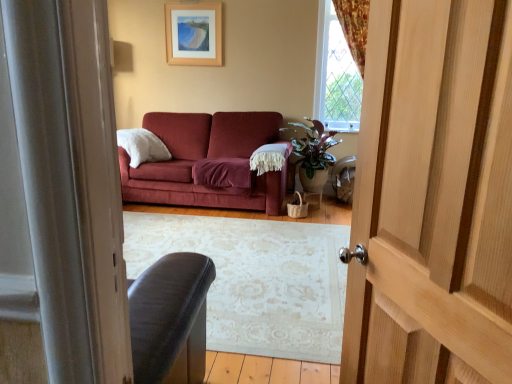
Describe the element at coordinates (313, 154) in the screenshot. I see `green glossy plant at center` at that location.

The width and height of the screenshot is (512, 384). Find the location of `clear glass window at upper right`. clear glass window at upper right is located at coordinates (336, 74).

Find the location of a particular element. wooden picture frame at upper center is located at coordinates (194, 34).

This screenshot has height=384, width=512. Identify the location of light brown wooden door at right. (433, 197).

Who is shorter, wooden picture frame at upper center or light brown wooden door at right?

Standing shorter between the two is wooden picture frame at upper center.

Consider the image. Considering the relative sizes of wooden picture frame at upper center and light brown wooden door at right in the image provided, is wooden picture frame at upper center bigger than light brown wooden door at right?

Actually, wooden picture frame at upper center might be smaller than light brown wooden door at right.

Measure the distance from wooden picture frame at upper center to light brown wooden door at right.

The distance of wooden picture frame at upper center from light brown wooden door at right is 4.11 meters.

Find the location of a particular element. This screenshot has height=384, width=512. door on the right of wooden picture frame at upper center is located at coordinates point(433,197).

In the image, is light brown wooden door at right on the left side or the right side of wooden picture frame at upper center?

light brown wooden door at right is positioned on wooden picture frame at upper center's right side.

Is light brown wooden door at right shorter than wooden picture frame at upper center?

Incorrect, the height of light brown wooden door at right does not fall short of that of wooden picture frame at upper center.

Can you confirm if light brown wooden door at right is wider than wooden picture frame at upper center?

Yes.

How distant is light brown wooden door at right from wooden picture frame at upper center?

light brown wooden door at right and wooden picture frame at upper center are 13.48 feet apart from each other.

Can you confirm if green glossy plant at center is positioned to the left of light brown wooden door at right?

No.

Considering the relative sizes of green glossy plant at center and light brown wooden door at right in the image provided, is green glossy plant at center wider than light brown wooden door at right?

Correct, the width of green glossy plant at center exceeds that of light brown wooden door at right.

Can you confirm if green glossy plant at center is bigger than light brown wooden door at right?

Yes.

Is green glossy plant at center taller or shorter than light brown wooden door at right?

Considering their sizes, green glossy plant at center has less height than light brown wooden door at right.

Can green glossy plant at center be found inside wooden picture frame at upper center?

Actually, green glossy plant at center is outside wooden picture frame at upper center.

Is wooden picture frame at upper center behind green glossy plant at center?

Yes, the depth of wooden picture frame at upper center is greater than that of green glossy plant at center.

Considering the relative sizes of wooden picture frame at upper center and green glossy plant at center in the image provided, is wooden picture frame at upper center taller than green glossy plant at center?

No, wooden picture frame at upper center is not taller than green glossy plant at center.

Can you tell me how much wooden picture frame at upper center and green glossy plant at center differ in facing direction?

There is a 1.53-degree angle between the facing directions of wooden picture frame at upper center and green glossy plant at center.

From a real-world perspective, is green glossy plant at center under clear glass window at upper right?

Correct, in the physical world, green glossy plant at center is lower than clear glass window at upper right.

Is green glossy plant at center positioned beyond the bounds of clear glass window at upper right?

Yes, green glossy plant at center is located beyond the bounds of clear glass window at upper right.

Is clear glass window at upper right at the back of green glossy plant at center?

Yes, green glossy plant at center is facing away from clear glass window at upper right.

Between green glossy plant at center and clear glass window at upper right, which one has less height?

green glossy plant at center is shorter.

Between light brown wooden door at right and green glossy plant at center, which one appears on the left side from the viewer's perspective?

light brown wooden door at right is more to the left.

From the image's perspective, is light brown wooden door at right on green glossy plant at center?

Incorrect, from the image's perspective, light brown wooden door at right is lower than green glossy plant at center.

Are light brown wooden door at right and green glossy plant at center beside each other?

light brown wooden door at right and green glossy plant at center are not in contact.

Does light brown wooden door at right have a smaller size compared to green glossy plant at center?

Indeed, light brown wooden door at right has a smaller size compared to green glossy plant at center.

Is clear glass window at upper right positioned with its back to wooden picture frame at upper center?

No, clear glass window at upper right's orientation is not away from wooden picture frame at upper center.

In the scene shown: Which point is more distant from viewer, (326, 24) or (211, 29)?

The point (211, 29) is behind.

From a real-world perspective, is clear glass window at upper right located higher than wooden picture frame at upper center?

No.

Is clear glass window at upper right surrounding wooden picture frame at upper center?

No, clear glass window at upper right does not contain wooden picture frame at upper center.

Locate an element on the screen. The width and height of the screenshot is (512, 384). door below the wooden picture frame at upper center (from the image's perspective) is located at coordinates (433, 197).

Find the location of `door on the right of wooden picture frame at upper center`. door on the right of wooden picture frame at upper center is located at coordinates (433, 197).

Considering their positions, is clear glass window at upper right positioned further to light brown wooden door at right than green glossy plant at center?

clear glass window at upper right.

Looking at the image, which one is located closer to clear glass window at upper right, green glossy plant at center or light brown wooden door at right?

green glossy plant at center lies closer to clear glass window at upper right than the other object.

Considering their positions, is light brown wooden door at right positioned closer to clear glass window at upper right than green glossy plant at center?

The object closer to clear glass window at upper right is green glossy plant at center.

Estimate the real-world distances between objects in this image. Which object is closer to wooden picture frame at upper center, clear glass window at upper right or light brown wooden door at right?

clear glass window at upper right is positioned closer to the anchor wooden picture frame at upper center.

Looking at the image, which one is located further to clear glass window at upper right, wooden picture frame at upper center or light brown wooden door at right?

light brown wooden door at right lies further to clear glass window at upper right than the other object.

Based on their spatial positions, is wooden picture frame at upper center or green glossy plant at center further from light brown wooden door at right?

The object further to light brown wooden door at right is wooden picture frame at upper center.

Which object lies further to the anchor point green glossy plant at center, light brown wooden door at right or clear glass window at upper right?

light brown wooden door at right.

Based on the photo, when comparing their distances from wooden picture frame at upper center, does green glossy plant at center or clear glass window at upper right seem closer?

Based on the image, clear glass window at upper right appears to be nearer to wooden picture frame at upper center.

I want to click on houseplant between wooden picture frame at upper center and clear glass window at upper right, so click(x=313, y=154).

Where is `houseplant located between light brown wooden door at right and clear glass window at upper right in the depth direction`? This screenshot has height=384, width=512. houseplant located between light brown wooden door at right and clear glass window at upper right in the depth direction is located at coordinates point(313,154).

Where is `window located between light brown wooden door at right and wooden picture frame at upper center in the depth direction`? Image resolution: width=512 pixels, height=384 pixels. window located between light brown wooden door at right and wooden picture frame at upper center in the depth direction is located at coordinates (336, 74).

Locate an element on the screen. This screenshot has width=512, height=384. houseplant between light brown wooden door at right and wooden picture frame at upper center in the front-back direction is located at coordinates (313, 154).